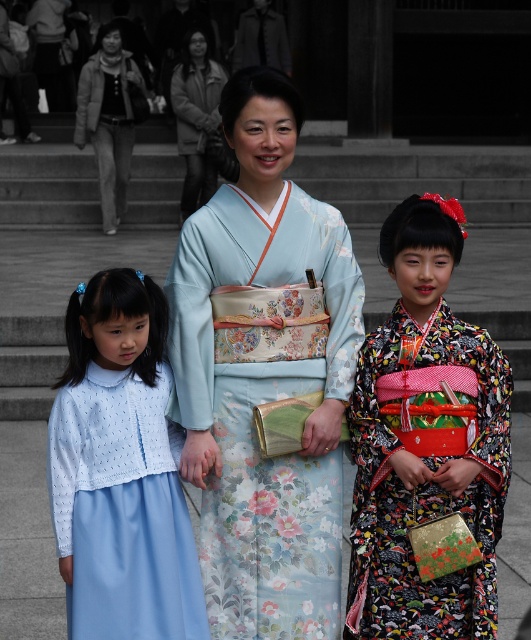
Who is lower down, light blue satin dress at left or floral silk kimono at center?

floral silk kimono at center is lower down.

From the picture: Is light blue satin dress at left to the right of floral silk kimono at center from the viewer's perspective?

No, light blue satin dress at left is not to the right of floral silk kimono at center.

Find the location of a particular element. This screenshot has height=640, width=531. light blue satin dress at left is located at coordinates (121, 470).

What do you see at coordinates (264, 372) in the screenshot? I see `light blue floral kimono at center` at bounding box center [264, 372].

Which is above, light blue floral kimono at center or floral silk kimono at center?

light blue floral kimono at center is higher up.

Which is behind, point (267, 346) or point (440, 401)?

Positioned behind is point (267, 346).

Locate an element on the screen. This screenshot has height=640, width=531. light blue floral kimono at center is located at coordinates (264, 372).

Consider the image. Can you confirm if light blue floral kimono at center is positioned to the right of light blue satin dress at left?

Yes, light blue floral kimono at center is to the right of light blue satin dress at left.

Does point (232, 568) come in front of point (109, 522)?

No, (232, 568) is behind (109, 522).

Is point (179, 240) positioned before point (178, 609)?

That is False.

This screenshot has height=640, width=531. I want to click on light blue floral kimono at center, so click(x=264, y=372).